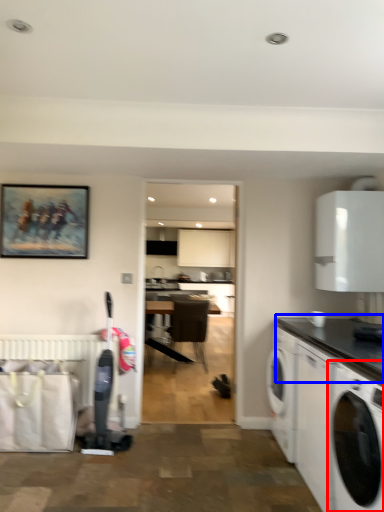
Question: Among these objects, which one is farthest to the camera, washing machine (highlighted by a red box) or countertop (highlighted by a blue box)?

Choices:
 (A) washing machine
 (B) countertop

Answer: (B)